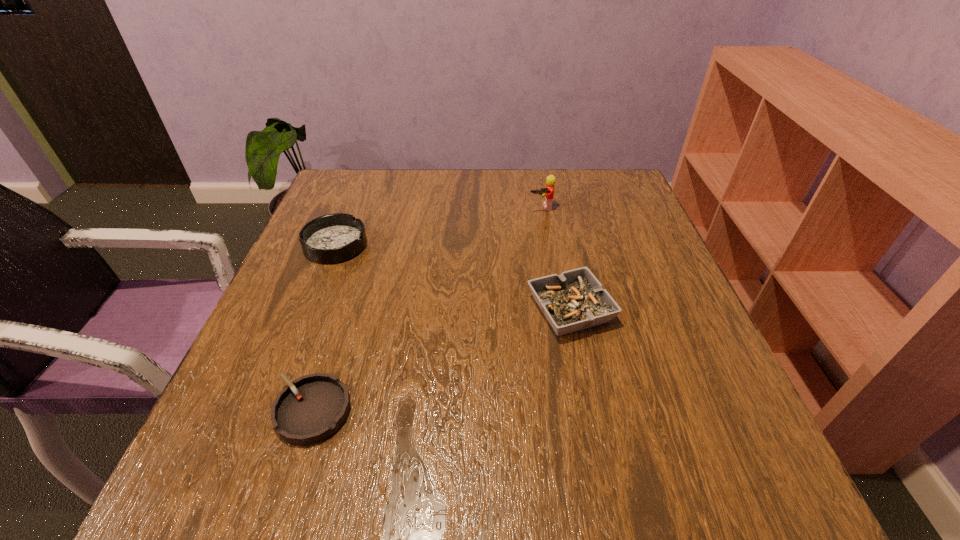
The image size is (960, 540). Identify the location of the second closest object to the third nearest object. (575, 300).

Identify the location of object that is the second closest to the second nearest object. Image resolution: width=960 pixels, height=540 pixels. (312, 408).

Locate an element on the screen. The width and height of the screenshot is (960, 540). the closest ashtray to the nearest object is located at coordinates point(333,238).

Identify which ashtray is located as the nearest to the shortest ashtray. Please provide its 2D coordinates. Your answer should be formatted as a tuple, i.e. [(x, y)], where the tuple contains the x and y coordinates of a point satisfying the conditions above.

[(333, 238)]

The image size is (960, 540). Identify the location of blank space that satisfies the following two spatial constraints: 1. in front of the Lego with the accessory visible; 2. on the left side of the rightmost ashtray. (561, 309).

This screenshot has height=540, width=960. What are the coordinates of `blank area in the image that satisfies the following two spatial constraints: 1. on the front side of the farthest ashtray; 2. on the left side of the nearest ashtray` in the screenshot? It's located at (271, 411).